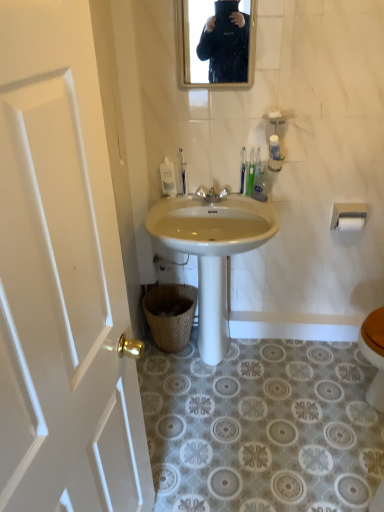
Find the location of `woven brown basket at lower center`. woven brown basket at lower center is located at coordinates (170, 315).

Where is `white matte toilet paper at upper right, placed as the first toilet paper when sorted from bottom to top`? white matte toilet paper at upper right, placed as the first toilet paper when sorted from bottom to top is located at coordinates (350, 222).

The height and width of the screenshot is (512, 384). What are the coordinates of `white matte toilet paper at upper right, the 2th toilet paper when ordered from bottom to top` in the screenshot? It's located at (349, 216).

What do you see at coordinates (349, 216) in the screenshot? I see `white matte toilet paper at upper right, the 2th toilet paper when ordered from bottom to top` at bounding box center [349, 216].

What is the approximate width of green plastic toothbrush at upper center, which is the 1th toilet brush from right to left?

1.31 inches.

In order to click on white glossy sink at center in this screenshot , I will do `click(211, 250)`.

Is green plastic toothbrush at upper center bigger than white matte soap at upper center?

Yes, green plastic toothbrush at upper center is bigger than white matte soap at upper center.

From a real-world perspective, is green plastic toothbrush at upper center on white matte soap at upper center?

No.

Is green plastic toothbrush at upper center spatially inside white matte soap at upper center, or outside of it?

green plastic toothbrush at upper center is not inside white matte soap at upper center, it's outside.

Who is taller, green plastic toothbrush at upper center or white matte soap at upper center?

green plastic toothbrush at upper center is taller.

Based on their sizes in the image, would you say white matte soap at upper center is bigger or smaller than white wood door at left?

Clearly, white matte soap at upper center is smaller in size than white wood door at left.

Locate an element on the screen. The height and width of the screenshot is (512, 384). soap that is above the white wood door at left (from a real-world perspective) is located at coordinates (274, 115).

Is white matte soap at upper center shorter than white wood door at left?

Yes.

Can you confirm if white matte soap at upper center is positioned to the left of white wood door at left?

In fact, white matte soap at upper center is to the right of white wood door at left.

From a real-world perspective, is white matte soap at upper center above or below green plastic toothbrush at upper center?

Clearly, from a real-world perspective, white matte soap at upper center is above green plastic toothbrush at upper center.

How distant is white matte soap at upper center from green plastic toothbrush at upper center?

The distance of white matte soap at upper center from green plastic toothbrush at upper center is 21.31 centimeters.

The height and width of the screenshot is (512, 384). Identify the location of soap positioned vertically above the green plastic toothbrush at upper center (from a real-world perspective). (274, 115).

From the picture: From the image's perspective, which one is positioned higher, white matte soap at upper center or green plastic toothbrush at upper center?

white matte soap at upper center appears higher in the image.

Where is `toiletry above the white matte toilet paper at upper right, the 2th toilet paper positioned from the top (from a real-world perspective)`? toiletry above the white matte toilet paper at upper right, the 2th toilet paper positioned from the top (from a real-world perspective) is located at coordinates (257, 168).

From the image's perspective, which is below, green plastic toothbrush at upper center or white matte toilet paper at upper right, the 2th toilet paper positioned from the top?

From the image's view, white matte toilet paper at upper right, the 2th toilet paper positioned from the top, is below.

Which object is positioned more to the right, green plastic toothbrush at upper center or white matte toilet paper at upper right, the 2th toilet paper positioned from the top?

Positioned to the right is white matte toilet paper at upper right, the 2th toilet paper positioned from the top.

Is point (260, 172) closer to camera compared to point (357, 225)?

Yes, point (260, 172) is in front of point (357, 225).

Is white matte toilet paper at upper right, acting as the 1th toilet paper starting from the top, positioned with its back to woven brown basket at lower center?

No, woven brown basket at lower center is not at the back of white matte toilet paper at upper right, acting as the 1th toilet paper starting from the top.

From the picture: Based on their positions, is white matte toilet paper at upper right, acting as the 1th toilet paper starting from the top, located to the left or right of woven brown basket at lower center?

white matte toilet paper at upper right, acting as the 1th toilet paper starting from the top, is positioned on woven brown basket at lower center's right side.

In the scene shown: Is white matte toilet paper at upper right, acting as the 1th toilet paper starting from the top, taller than woven brown basket at lower center?

No, white matte toilet paper at upper right, acting as the 1th toilet paper starting from the top, is not taller than woven brown basket at lower center.

From their relative heights in the image, would you say white matte toilet paper at upper right, the 2th toilet paper when ordered from bottom to top, is taller or shorter than white matte soap at upper center?

In the image, white matte toilet paper at upper right, the 2th toilet paper when ordered from bottom to top, appears to be taller than white matte soap at upper center.

Is white matte toilet paper at upper right, acting as the 1th toilet paper starting from the top, facing towards white matte soap at upper center?

No, white matte toilet paper at upper right, acting as the 1th toilet paper starting from the top, is not oriented towards white matte soap at upper center.

Considering the relative sizes of white matte toilet paper at upper right, the 2th toilet paper when ordered from bottom to top, and white matte soap at upper center in the image provided, is white matte toilet paper at upper right, the 2th toilet paper when ordered from bottom to top, smaller than white matte soap at upper center?

Incorrect, white matte toilet paper at upper right, the 2th toilet paper when ordered from bottom to top, is not smaller in size than white matte soap at upper center.

Considering the relative positions of white plastic toilet brush at center, which is counted as the third toilet brush, starting from the right, and white glossy sink at center in the image provided, is white plastic toilet brush at center, which is counted as the third toilet brush, starting from the right, to the left of white glossy sink at center from the viewer's perspective?

Indeed, white plastic toilet brush at center, which is counted as the third toilet brush, starting from the right, is positioned on the left side of white glossy sink at center.

From a real-world perspective, which is physically above, white plastic toilet brush at center, which is the first toilet brush in left-to-right order, or white glossy sink at center?

white plastic toilet brush at center, which is the first toilet brush in left-to-right order, is physically above.

Is white plastic toilet brush at center, which is counted as the third toilet brush, starting from the right, bigger or smaller than white glossy sink at center?

Clearly, white plastic toilet brush at center, which is counted as the third toilet brush, starting from the right, is smaller in size than white glossy sink at center.

This screenshot has width=384, height=512. I want to click on soap that is in front of the green plastic toothbrush at upper center, so coord(274,115).

Where is `soap behind the white wood door at left`? Image resolution: width=384 pixels, height=512 pixels. soap behind the white wood door at left is located at coordinates (274, 115).

Based on their spatial positions, is white glossy sink at center or green plastic toothbrush at upper center, which is the 1th toilet brush from right to left, further from white plastic toilet brush at center, which is counted as the third toilet brush, starting from the right?

Based on the image, white glossy sink at center appears to be further to white plastic toilet brush at center, which is counted as the third toilet brush, starting from the right.

Based on their spatial positions, is green plastic toothbrush at upper center, which is the 1th toilet brush from right to left, or matte black mirror at upper center closer to white plastic toilet brush at center, which is counted as the third toilet brush, starting from the right?

green plastic toothbrush at upper center, which is the 1th toilet brush from right to left, is closer to white plastic toilet brush at center, which is counted as the third toilet brush, starting from the right.

Estimate the real-world distances between objects in this image. Which object is further from green plastic toothbrush at upper center, white matte toilet paper at upper right, the 2th toilet paper positioned from the top, or white glossy sink at center?

white matte toilet paper at upper right, the 2th toilet paper positioned from the top, lies further to green plastic toothbrush at upper center than the other object.

When comparing their distances from white wood door at left, does white matte toilet paper at upper right, the 2th toilet paper positioned from the top, or woven brown basket at lower center seem closer?

Among the two, woven brown basket at lower center is located nearer to white wood door at left.

Consider the image. Looking at the image, which one is located further to white glossy sink at center, white plastic toothbrush at upper center, which ranks as the 2th toilet brush in left-to-right order, or white matte soap at upper center?

white matte soap at upper center lies further to white glossy sink at center than the other object.

Which object lies further to the anchor point white plastic soap dispenser at center, matte black mirror at upper center or green plastic toothbrush at upper center, which is the 1th toilet brush from right to left?

matte black mirror at upper center is positioned further to the anchor white plastic soap dispenser at center.

Based on their spatial positions, is green plastic toothbrush at upper center, which is the 1th toilet brush from right to left, or white matte toilet paper at upper right, placed as the first toilet paper when sorted from bottom to top, closer to white matte toilet paper at upper right, acting as the 1th toilet paper starting from the top?

white matte toilet paper at upper right, placed as the first toilet paper when sorted from bottom to top, lies closer to white matte toilet paper at upper right, acting as the 1th toilet paper starting from the top, than the other object.

From the image, which object appears to be farther from white plastic toilet brush at center, which is the first toilet brush in left-to-right order, matte black mirror at upper center or white plastic toothbrush at upper center, positioned as the 2th toilet brush in right-to-left order?

matte black mirror at upper center is positioned further to the anchor white plastic toilet brush at center, which is the first toilet brush in left-to-right order.

Where is `toiletry between white matte soap at upper center and woven brown basket at lower center vertically`? toiletry between white matte soap at upper center and woven brown basket at lower center vertically is located at coordinates (257, 168).

At what (x,y) coordinates should I click in order to perform the action: click on toiletry between green plastic toothbrush at upper center, which is the 1th toilet brush from right to left, and white matte toilet paper at upper right, the 2th toilet paper when ordered from bottom to top. Please return your answer as a coordinate pair (x, y). Looking at the image, I should click on (257, 168).

Where is `soap between white wood door at left and green plastic toothbrush at upper center, which is the 1th toilet brush from right to left, from front to back`? The image size is (384, 512). soap between white wood door at left and green plastic toothbrush at upper center, which is the 1th toilet brush from right to left, from front to back is located at coordinates (274, 115).

Find the location of a particular element. The image size is (384, 512). soap between white wood door at left and white matte toilet paper at upper right, the 2th toilet paper when ordered from bottom to top, in the front-back direction is located at coordinates (274, 115).